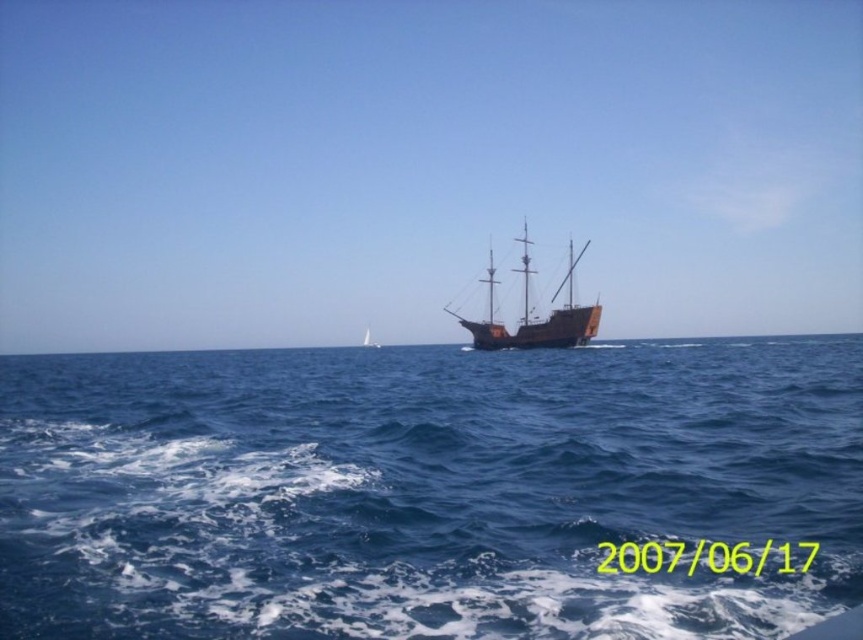
You are standing on a cliff overlooking the blue water at center and the wooden ship at center. Which object is closer to the bottom edge of your view?

The blue water at center is located below the wooden ship at center, so the blue water at center is closer to the bottom edge of your view.

You are standing on the dock and looking out at the blue water at center and the brown wooden ship at center. Which object is closer to you?

The blue water at center is closer to you because it is in front of the brown wooden ship at center.

You are standing on the deck of the large wooden sailing ship with three masts in the midground. You want to locate the blue water at center. According to the coordinates given, in which direction should you look to find it?

The blue water at center is located at coordinates point (x=423, y=490). Since the coordinate system places (x=0, y=0) at the bottom left corner, looking towards the upper right direction from the ship would align with those coordinates.